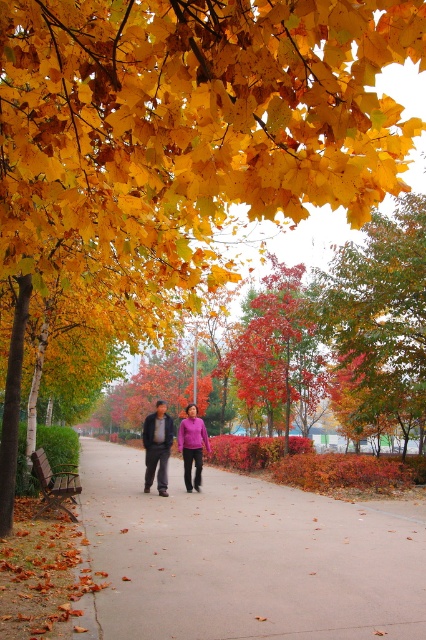
Question: Is green leafy tree at upper right in front of dark gray fabric jacket at center?

Choices:
 (A) yes
 (B) no

Answer: (B)

Question: Is green leafy tree at upper right wider than shiny red leaves at center?

Choices:
 (A) yes
 (B) no

Answer: (B)

Question: Which point appears closest to the camera in this image?

Choices:
 (A) (195, 460)
 (B) (268, 385)

Answer: (A)

Question: Which object is the farthest from the shiny red leaves at center?

Choices:
 (A) dark gray fabric jacket at center
 (B) concrete pavement at center
 (C) purple matte shirt at center

Answer: (C)

Question: Can you confirm if matte purple sweater at center is positioned to the right of dark gray fabric jacket at center?

Choices:
 (A) yes
 (B) no

Answer: (A)

Question: Which is farther from the purple matte shirt at center?

Choices:
 (A) matte purple sweater at center
 (B) dark gray fabric jacket at center

Answer: (B)